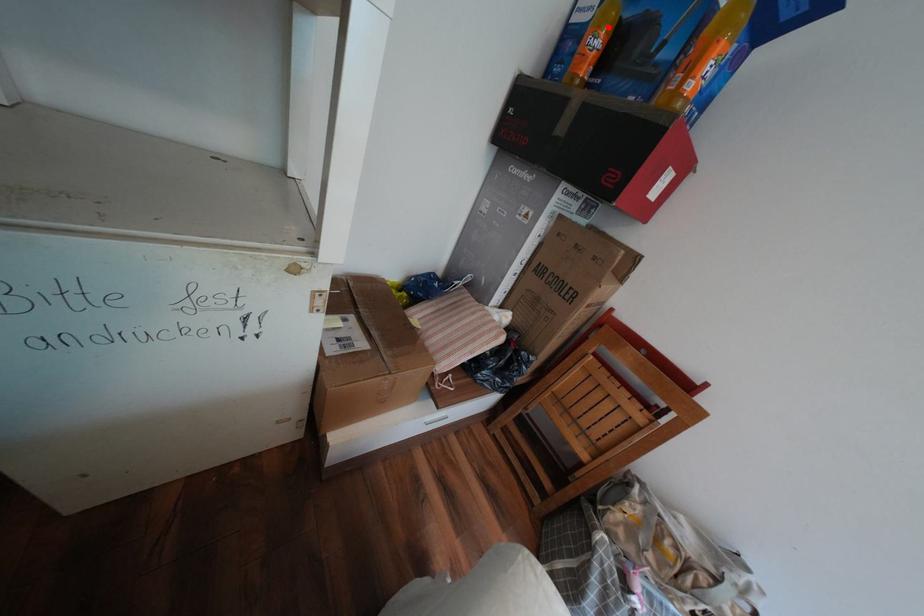
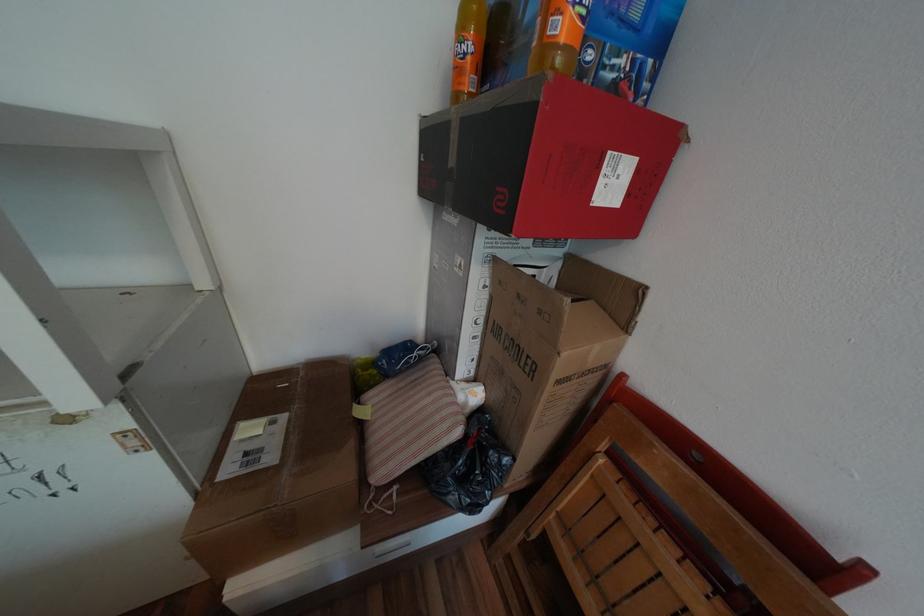
Where in the second image is the point corresponding to the highlighted location from the first image?

(472, 31)